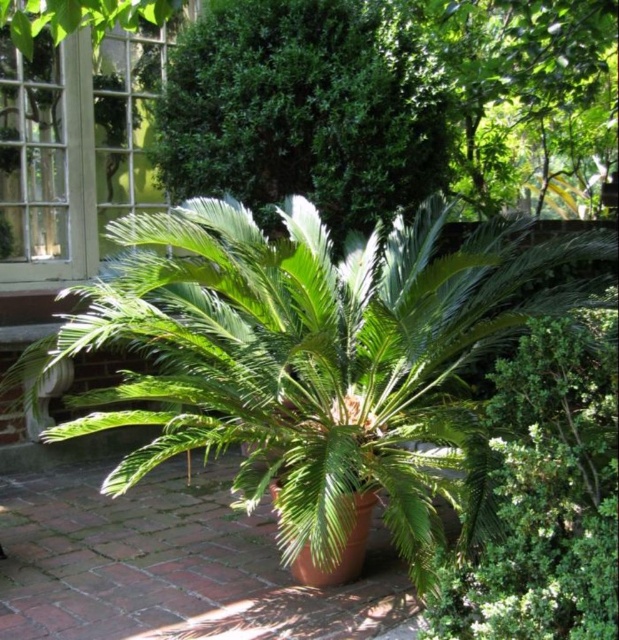
Question: Which object is farther from the camera taking this photo?

Choices:
 (A) green leafy bush at center
 (B) green leafy palm at center

Answer: (A)

Question: Is green leafy palm at center smaller than green leafy bush at center?

Choices:
 (A) no
 (B) yes

Answer: (A)

Question: Is green leafy palm at center wider than green leafy bush at center?

Choices:
 (A) no
 (B) yes

Answer: (B)

Question: Which point appears closest to the camera in this image?

Choices:
 (A) 202,413
 (B) 215,100

Answer: (A)

Question: Does green leafy palm at center have a lesser width compared to green leafy bush at center?

Choices:
 (A) yes
 (B) no

Answer: (B)